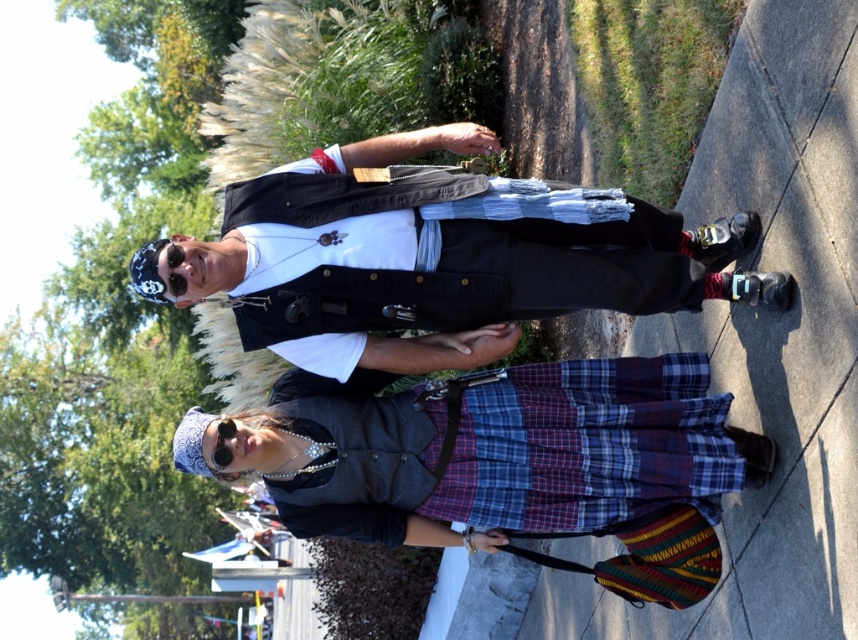
Question: Which point is closer to the camera?

Choices:
 (A) (307, 250)
 (B) (347, 397)

Answer: (A)

Question: Among these points, which one is farthest from the camera?

Choices:
 (A) (263, 442)
 (B) (748, 244)

Answer: (B)

Question: Is matte black vest at center thinner than plaid fabric skirt at center?

Choices:
 (A) no
 (B) yes

Answer: (A)

Question: Does matte black vest at center appear on the left side of plaid fabric skirt at center?

Choices:
 (A) yes
 (B) no

Answer: (A)

Question: Is matte black vest at center in front of plaid fabric skirt at center?

Choices:
 (A) yes
 (B) no

Answer: (A)